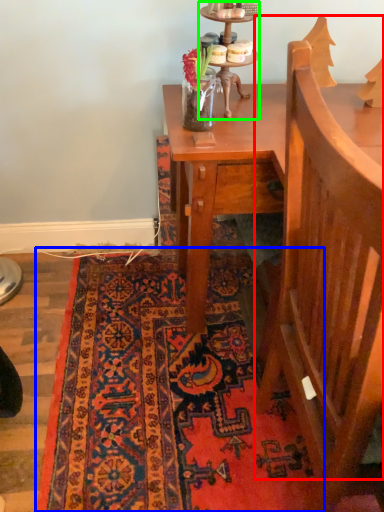
Question: Which object is positioned farthest from armchair (highlighted by a red box)? Select from mat (highlighted by a blue box) and candle holder (highlighted by a green box).

Choices:
 (A) mat
 (B) candle holder

Answer: (B)